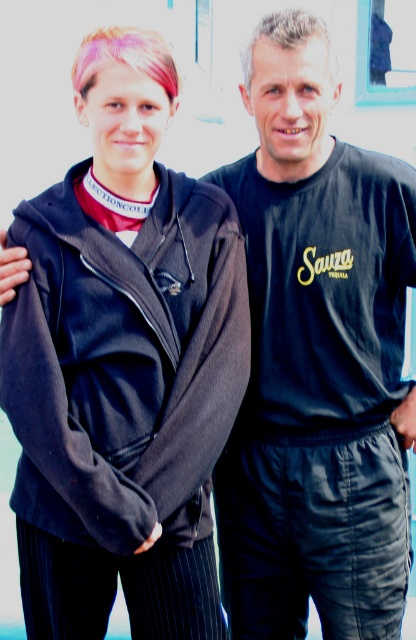
You are a photographer trying to capture a group photo of the two people in the image. The minimum distance required between subjects for your camera to focus properly is 4 feet. Based on the scene, will the dark gray fleece sweatshirt at left and slightly grayish blonde hair at upper center be in focus?

The dark gray fleece sweatshirt at left and slightly grayish blonde hair at upper center are 3.91 feet apart from each other, which is less than the required 4 feet for proper focus. Therefore, they may not be in focus.

You are standing at the position of the viewer and want to hand a small item to the person wearing the dark gray fleece sweatshirt at left. Can you reach them without moving from your current position if your arm can extend 1.2 meters?

The dark gray fleece sweatshirt at left and viewer are 3.15 meters apart from each other. Since your arm can only extend 1.2 meters, you cannot reach them without moving closer.